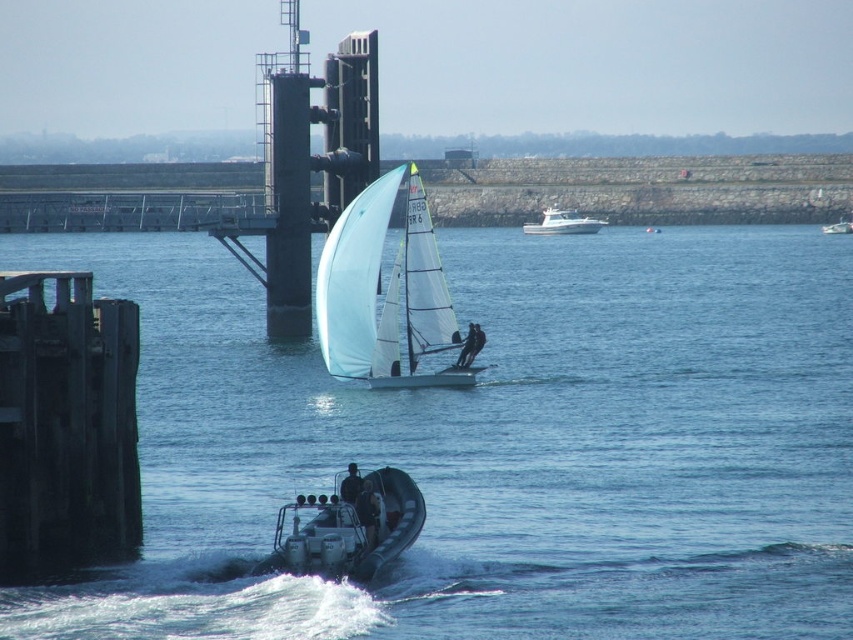
Is point (440, 262) less distant than point (469, 342)?

No, (440, 262) is further to viewer.

Is the position of white matte sailboat at center more distant than that of smooth white sail at center?

Yes.

At what (x,y) coordinates should I click in order to perform the action: click on white matte sailboat at center. Please return your answer as a coordinate pair (x, y). Image resolution: width=853 pixels, height=640 pixels. Looking at the image, I should click on (386, 291).

Image resolution: width=853 pixels, height=640 pixels. Describe the element at coordinates (367, 512) in the screenshot. I see `dark blue fabric jacket at lower center` at that location.

Between point (374, 509) and point (846, 218), which one is positioned in front?

Positioned in front is point (374, 509).

Locate an element on the screen. dark blue fabric jacket at lower center is located at coordinates (367, 512).

This screenshot has height=640, width=853. Find the location of `dark blue fabric jacket at lower center`. dark blue fabric jacket at lower center is located at coordinates (367, 512).

Can you confirm if white matte sailboat at center is positioned to the right of white glossy boat at upper center?

No, white matte sailboat at center is not to the right of white glossy boat at upper center.

Can you confirm if white matte sailboat at center is smaller than white glossy boat at upper center?

Yes.

Identify the location of white matte sailboat at center. This screenshot has width=853, height=640. (386, 291).